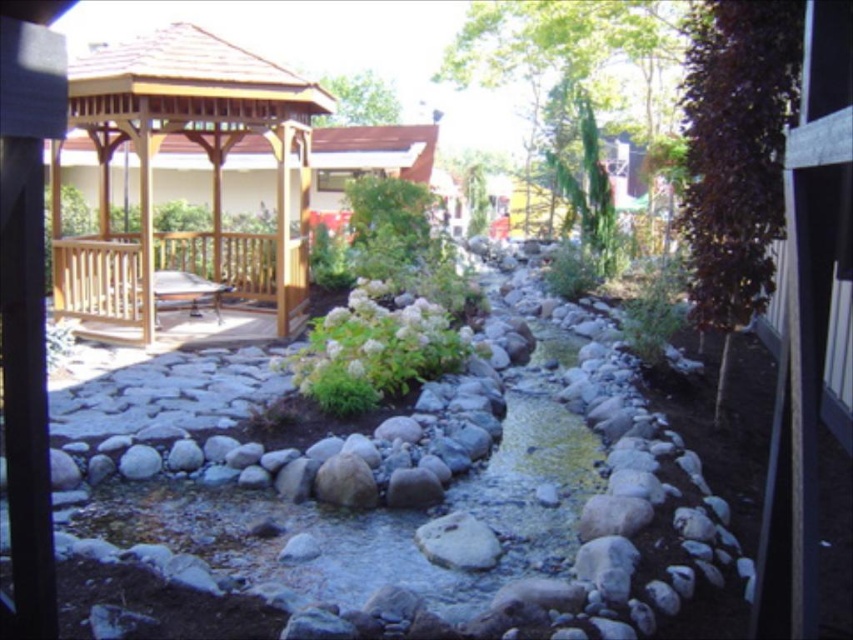
Question: Which point is farther from the camera taking this photo?

Choices:
 (A) (180, 44)
 (B) (338, 364)

Answer: (A)

Question: Does wooden gazebo at upper left have a smaller size compared to white fluffy bush at center?

Choices:
 (A) no
 (B) yes

Answer: (B)

Question: Does wooden gazebo at upper left have a lesser width compared to white fluffy bush at center?

Choices:
 (A) yes
 (B) no

Answer: (A)

Question: Which object appears closest to the camera in this image?

Choices:
 (A) wooden gazebo at upper left
 (B) white fluffy bush at center

Answer: (B)

Question: Observing the image, what is the correct spatial positioning of wooden gazebo at upper left in reference to white fluffy bush at center?

Choices:
 (A) below
 (B) above

Answer: (B)